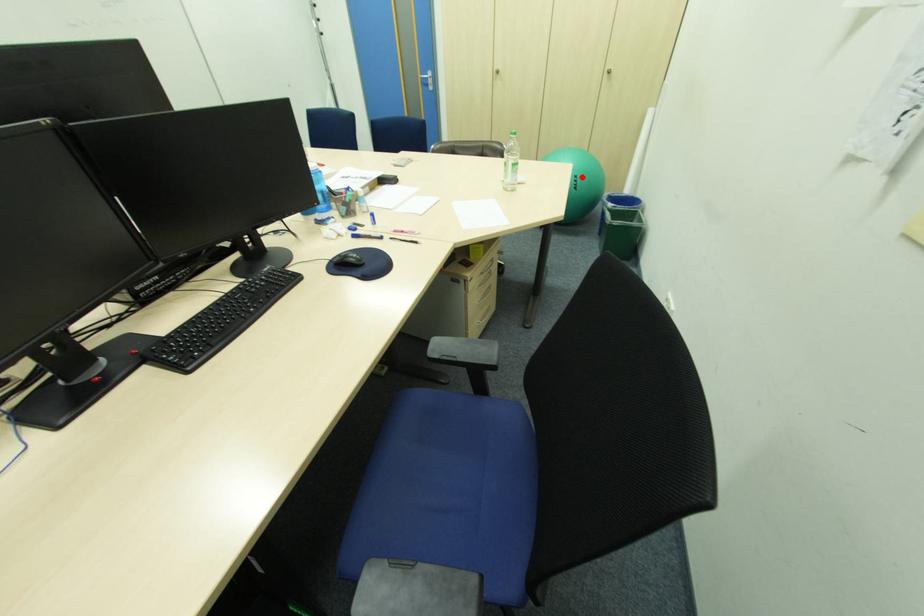
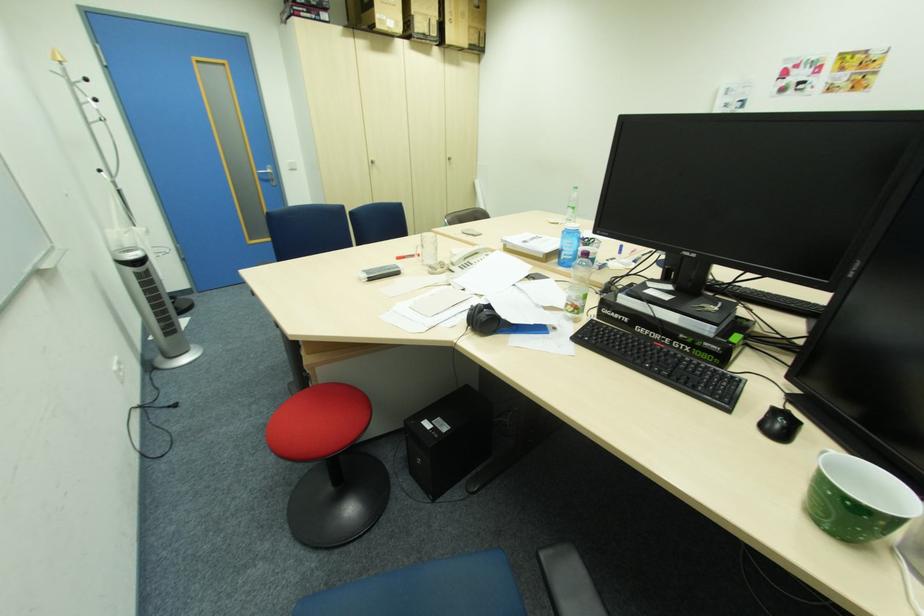
Question: I am providing you with two images of the same scene from different viewpoints. A red point is marked on the first image. Is the red point's position out of view in image 2?

Choices:
 (A) Yes
 (B) No

Answer: (A)